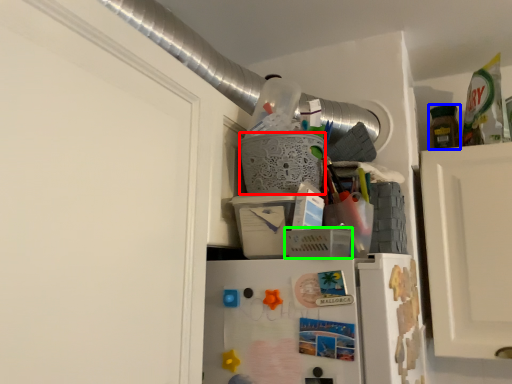
Question: Based on their relative distances, which object is farther from basket (highlighted by a red box)? Choose from bottle (highlighted by a blue box) and basket (highlighted by a green box).

Choices:
 (A) bottle
 (B) basket

Answer: (A)